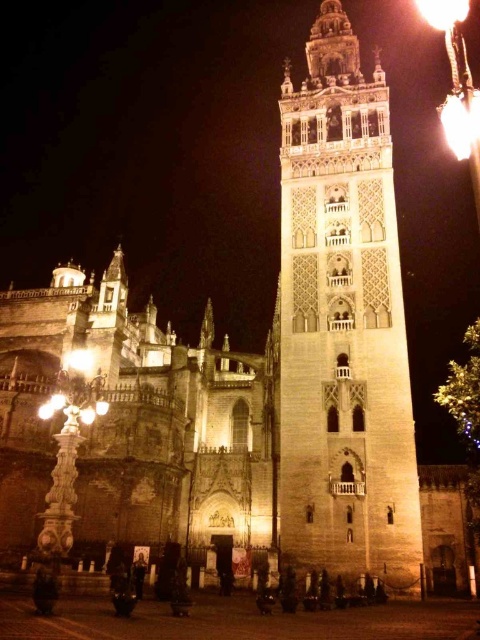
You are an architect analyzing the facade of the building. You notice the light beige stone bell tower at center and the bright yellow flame at upper right. Which object has a greater width?

The bright yellow flame at upper right has a greater width than the light beige stone bell tower at center.

In the scene shown: You are an architect analyzing the building layout. Which object in the scene takes up more visual space, the light beige stone bell tower at center or the bright yellow flame at upper right?

The bright yellow flame at upper right takes up more visual space than the light beige stone bell tower at center.